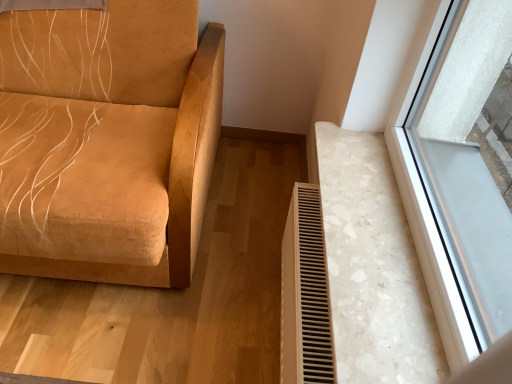
The width and height of the screenshot is (512, 384). Describe the element at coordinates (106, 140) in the screenshot. I see `suede-like tan sofa at left` at that location.

Identify the location of suede-like tan sofa at left. This screenshot has width=512, height=384. [106, 140].

Where is `white textured radiator at lower right`? The height and width of the screenshot is (384, 512). white textured radiator at lower right is located at coordinates (305, 293).

Image resolution: width=512 pixels, height=384 pixels. What do you see at coordinates (305, 293) in the screenshot?
I see `white textured radiator at lower right` at bounding box center [305, 293].

This screenshot has width=512, height=384. Find the location of `suede-like tan sofa at left`. suede-like tan sofa at left is located at coordinates (106, 140).

Considering the relative positions of suede-like tan sofa at left and white textured radiator at lower right in the image provided, is suede-like tan sofa at left to the left or to the right of white textured radiator at lower right?

From the image, it's evident that suede-like tan sofa at left is to the left of white textured radiator at lower right.

Considering their positions, is suede-like tan sofa at left located in front of or behind white textured radiator at lower right?

Clearly, suede-like tan sofa at left is in front of white textured radiator at lower right.

Which is behind, point (61, 20) or point (298, 278)?

The point (61, 20) is farther from the camera.

From the image's perspective, is suede-like tan sofa at left located beneath white textured radiator at lower right?

Incorrect, from the image's perspective, suede-like tan sofa at left is higher than white textured radiator at lower right.

From a real-world perspective, which object stands above the other?

suede-like tan sofa at left, from a real-world perspective.

Is suede-like tan sofa at left wider or thinner than white textured radiator at lower right?

suede-like tan sofa at left is wider than white textured radiator at lower right.

In terms of height, does suede-like tan sofa at left look taller or shorter compared to white textured radiator at lower right?

Considering their sizes, suede-like tan sofa at left has more height than white textured radiator at lower right.

Is suede-like tan sofa at left bigger or smaller than white textured radiator at lower right?

Considering their sizes, suede-like tan sofa at left takes up more space than white textured radiator at lower right.

Would you say suede-like tan sofa at left is inside or outside white textured radiator at lower right?

suede-like tan sofa at left cannot be found inside white textured radiator at lower right.

Based on the photo, is suede-like tan sofa at left touching white textured radiator at lower right?

No, suede-like tan sofa at left is not making contact with white textured radiator at lower right.

Is suede-like tan sofa at left turned away from white textured radiator at lower right?

No, suede-like tan sofa at left is not facing the opposite direction of white textured radiator at lower right.

Can you tell me how much suede-like tan sofa at left and white textured radiator at lower right differ in facing direction?

90.4 degrees.

Identify the location of furniture above the white textured radiator at lower right (from the image's perspective). This screenshot has width=512, height=384. (106, 140).

Considering the relative positions of white textured radiator at lower right and suede-like tan sofa at left in the image provided, is white textured radiator at lower right to the left or to the right of suede-like tan sofa at left?

In the image, white textured radiator at lower right appears on the right side of suede-like tan sofa at left.

Which object is more forward, white textured radiator at lower right or suede-like tan sofa at left?

suede-like tan sofa at left is closer to the camera.

Considering the points (294, 237) and (199, 61), which point is behind, point (294, 237) or point (199, 61)?

Point (199, 61)

From the image's perspective, is white textured radiator at lower right located above or below suede-like tan sofa at left?

white textured radiator at lower right is below suede-like tan sofa at left.

From a real-world perspective, between white textured radiator at lower right and suede-like tan sofa at left, who is vertically higher?

suede-like tan sofa at left is physically above.

Considering the sizes of objects white textured radiator at lower right and suede-like tan sofa at left in the image provided, who is thinner, white textured radiator at lower right or suede-like tan sofa at left?

white textured radiator at lower right.

Considering the sizes of white textured radiator at lower right and suede-like tan sofa at left in the image, is white textured radiator at lower right taller or shorter than suede-like tan sofa at left?

Considering their sizes, white textured radiator at lower right has less height than suede-like tan sofa at left.

Considering the sizes of objects white textured radiator at lower right and suede-like tan sofa at left in the image provided, who is smaller, white textured radiator at lower right or suede-like tan sofa at left?

With smaller size is white textured radiator at lower right.

Is white textured radiator at lower right located outside suede-like tan sofa at left?

Yes, white textured radiator at lower right is located beyond the bounds of suede-like tan sofa at left.

Is white textured radiator at lower right far away from suede-like tan sofa at left?

No, white textured radiator at lower right is not far away from suede-like tan sofa at left.

Is white textured radiator at lower right aimed at suede-like tan sofa at left?

Yes, white textured radiator at lower right is turned towards suede-like tan sofa at left.

How many degrees apart are the facing directions of white textured radiator at lower right and suede-like tan sofa at left?

90.4 degrees.

Identify the location of radiator that appears below the suede-like tan sofa at left (from the image's perspective). (305, 293).

The image size is (512, 384). I want to click on radiator behind the suede-like tan sofa at left, so click(x=305, y=293).

At what (x,y) coordinates should I click in order to perform the action: click on radiator lying on the right of suede-like tan sofa at left. Please return your answer as a coordinate pair (x, y). Image resolution: width=512 pixels, height=384 pixels. Looking at the image, I should click on (305, 293).